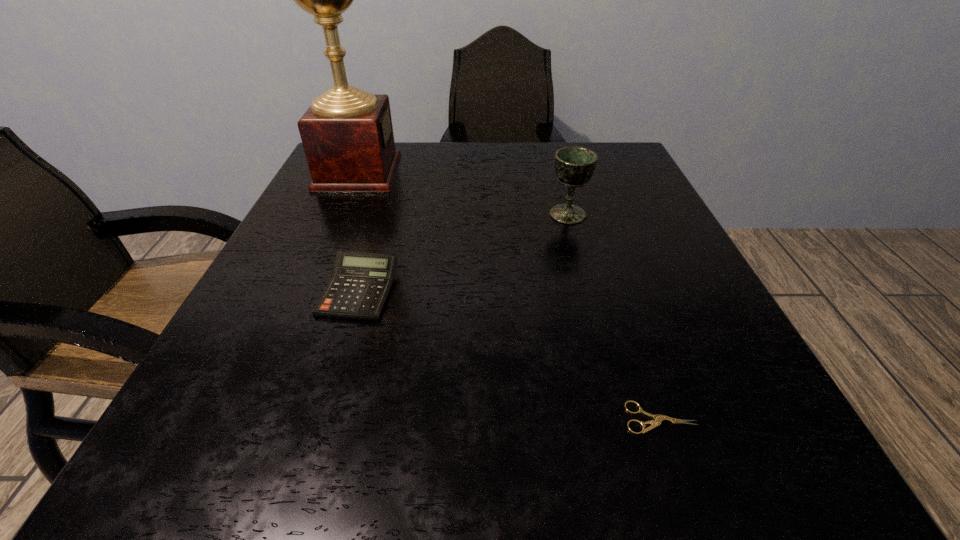
You are a GUI agent. You are given a task and a screenshot of the screen. Output one action in this format:
    pyautogui.click(x=<x>, y=<y>)
    Task: Click on the vacant area that lies between the calculator and the chalice
    The width and height of the screenshot is (960, 540).
    Given the screenshot: What is the action you would take?
    pyautogui.click(x=464, y=253)

Find the location of a particular element. The image size is (960, 540). vacant space in between the third shortest object and the third farthest object is located at coordinates (464, 253).

Locate an element on the screen. empty location between the chalice and the nearest object is located at coordinates (613, 316).

Select which object is the closest to the second tallest object. Please provide its 2D coordinates. Your answer should be formatted as a tuple, i.e. [(x, y)], where the tuple contains the x and y coordinates of a point satisfying the conditions above.

[(360, 284)]

Identify which object is located as the second nearest to the trophy cup. Please provide its 2D coordinates. Your answer should be formatted as a tuple, i.e. [(x, y)], where the tuple contains the x and y coordinates of a point satisfying the conditions above.

[(574, 166)]

Where is `blank area in the image that satisfies the following two spatial constraints: 1. on the plaque of the tallest object; 2. on the right side of the calculator`? This screenshot has height=540, width=960. blank area in the image that satisfies the following two spatial constraints: 1. on the plaque of the tallest object; 2. on the right side of the calculator is located at coordinates (306, 291).

The width and height of the screenshot is (960, 540). I want to click on blank space that satisfies the following two spatial constraints: 1. on the plaque of the trophy cup; 2. on the left side of the calculator, so click(306, 291).

Locate an element on the screen. vacant area that satisfies the following two spatial constraints: 1. on the front side of the chalice; 2. on the left side of the nearest object is located at coordinates (623, 418).

Locate an element on the screen. The image size is (960, 540). vacant space that satisfies the following two spatial constraints: 1. on the plaque of the second tallest object; 2. on the right side of the trophy cup is located at coordinates (340, 214).

Locate an element on the screen. The width and height of the screenshot is (960, 540). vacant region that satisfies the following two spatial constraints: 1. on the back side of the chalice; 2. on the left side of the second nearest object is located at coordinates (382, 214).